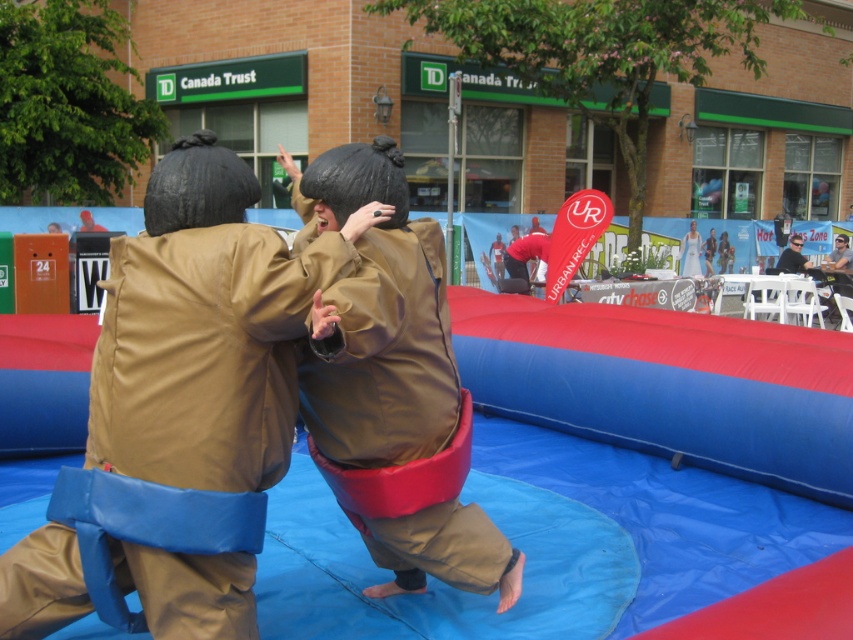
You are a photographer trying to capture a closeup shot of the brown matte sumo at center and the smooth black sunglasses at upper right. Given their sizes, which object should you focus on first to ensure both are in frame without zooming in or out?

The brown matte sumo at center is larger than the smooth black sunglasses at upper right, so you should focus on the brown matte sumo at center first to ensure both fit in the frame without zooming.

You are a photographer positioned at the center of the sumo wrestling area. You want to capture a photo of the brown leather sumo at center. Based on its position, which direction should you aim your camera to ensure it is in the frame?

The brown leather sumo at center is located at point coordinates, so you should aim your camera towards the center of the frame to capture it properly.